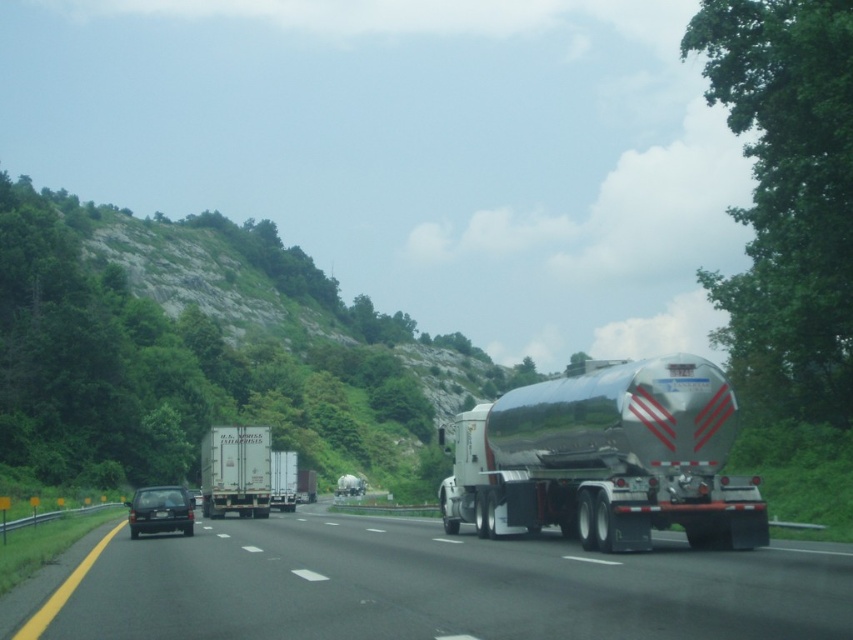
Question: Does shiny metallic tanker at right have a lesser width compared to white matte trailer at center?

Choices:
 (A) yes
 (B) no

Answer: (A)

Question: Which object appears farthest from the camera in this image?

Choices:
 (A) rocky terrain at upper left
 (B) shiny metallic tanker at right
 (C) white matte trailer at center

Answer: (C)

Question: Which point is farther to the camera?

Choices:
 (A) (270, 236)
 (B) (289, 483)
 (C) (674, 509)

Answer: (A)

Question: From the image, what is the correct spatial relationship of silver metallic tanker truck at center-right in relation to shiny metallic tanker at right?

Choices:
 (A) right
 (B) left

Answer: (B)

Question: Is silver metallic tanker truck at center-right thinner than white matte trailer at center?

Choices:
 (A) no
 (B) yes

Answer: (A)

Question: Which point is farther to the camera?

Choices:
 (A) shiny metallic tanker at right
 (B) silver metallic tanker truck at center-right
 (C) white matte trailer at center

Answer: (C)